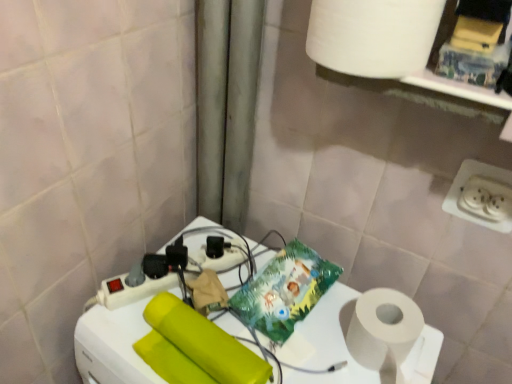
Question: Could you tell me if white plastic power strip at center is facing matte yellow toilet paper at center?

Choices:
 (A) no
 (B) yes

Answer: (A)

Question: Can you confirm if white plastic power strip at center is thinner than matte yellow toilet paper at center?

Choices:
 (A) yes
 (B) no

Answer: (B)

Question: Considering the relative positions of white plastic power strip at center and matte yellow toilet paper at center in the image provided, is white plastic power strip at center to the left of matte yellow toilet paper at center from the viewer's perspective?

Choices:
 (A) yes
 (B) no

Answer: (B)

Question: Considering the relative sizes of white plastic power strip at center and matte yellow toilet paper at center in the image provided, is white plastic power strip at center taller than matte yellow toilet paper at center?

Choices:
 (A) no
 (B) yes

Answer: (B)

Question: Is white plastic power strip at center shorter than matte yellow toilet paper at center?

Choices:
 (A) no
 (B) yes

Answer: (A)

Question: Is point (128, 336) closer or farther from the camera than point (495, 178)?

Choices:
 (A) closer
 (B) farther

Answer: (A)

Question: Based on their positions, is white plastic power strip at center located to the left or right of white plastic power plugs and sockets at lower right?

Choices:
 (A) right
 (B) left

Answer: (B)

Question: From their relative heights in the image, would you say white plastic power strip at center is taller or shorter than white plastic power plugs and sockets at lower right?

Choices:
 (A) tall
 (B) short

Answer: (A)

Question: Is white plastic power strip at center spatially inside white plastic power plugs and sockets at lower right, or outside of it?

Choices:
 (A) outside
 (B) inside

Answer: (A)

Question: Choose the correct answer: Is matte yellow toilet paper at center inside white matte paper towel at upper right or outside it?

Choices:
 (A) outside
 (B) inside

Answer: (A)

Question: Based on their sizes in the image, would you say matte yellow toilet paper at center is bigger or smaller than white matte paper towel at upper right?

Choices:
 (A) big
 (B) small

Answer: (B)

Question: Visually, is matte yellow toilet paper at center positioned to the left or to the right of white matte paper towel at upper right?

Choices:
 (A) right
 (B) left

Answer: (B)

Question: From a real-world perspective, is matte yellow toilet paper at center above or below white matte paper towel at upper right?

Choices:
 (A) above
 (B) below

Answer: (B)

Question: From the image's perspective, is white matte paper towel at upper right located above or below matte yellow toilet paper at center?

Choices:
 (A) below
 (B) above

Answer: (B)

Question: Is white matte paper towel at upper right taller or shorter than matte yellow toilet paper at center?

Choices:
 (A) short
 (B) tall

Answer: (A)